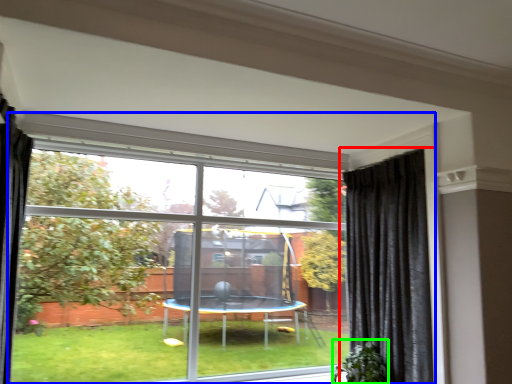
Question: Which object is the farthest from curtain (highlighted by a red box)? Choose among these: window (highlighted by a blue box) or plant (highlighted by a green box).

Choices:
 (A) window
 (B) plant

Answer: (A)